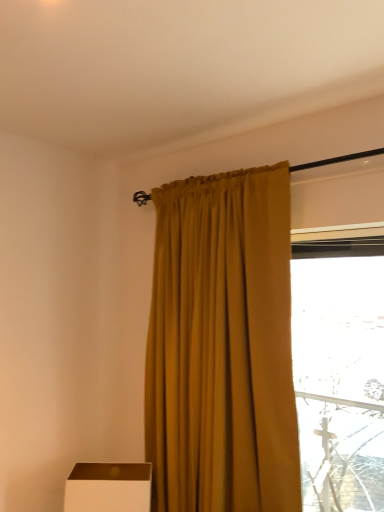
Question: Is mustard fabric curtain at center bigger or smaller than white matte box at lower left?

Choices:
 (A) big
 (B) small

Answer: (A)

Question: From a real-world perspective, is mustard fabric curtain at center physically located above or below white matte box at lower left?

Choices:
 (A) above
 (B) below

Answer: (A)

Question: Which is correct: mustard fabric curtain at center is inside white matte box at lower left, or outside of it?

Choices:
 (A) inside
 (B) outside

Answer: (B)

Question: In the image, is white matte box at lower left on the left side or the right side of mustard fabric curtain at center?

Choices:
 (A) left
 (B) right

Answer: (A)

Question: From a real-world perspective, relative to mustard fabric curtain at center, is white matte box at lower left vertically above or below?

Choices:
 (A) below
 (B) above

Answer: (A)

Question: Looking at their shapes, would you say white matte box at lower left is wider or thinner than mustard fabric curtain at center?

Choices:
 (A) wide
 (B) thin

Answer: (A)

Question: In terms of size, does white matte box at lower left appear bigger or smaller than mustard fabric curtain at center?

Choices:
 (A) big
 (B) small

Answer: (B)